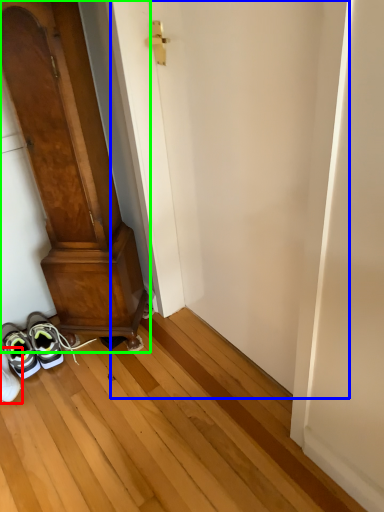
Question: Estimate the real-world distances between objects in this image. Which object is farther from footwear (highlighted by a red box), door (highlighted by a blue box) or door (highlighted by a green box)?

Choices:
 (A) door
 (B) door

Answer: (A)